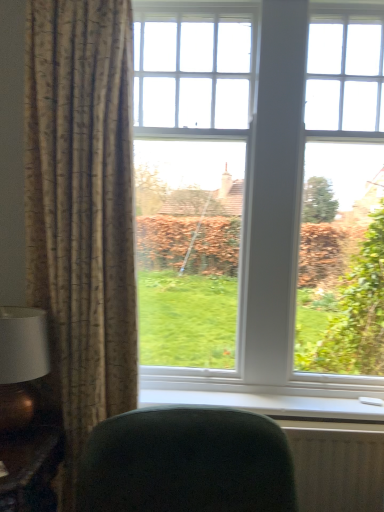
Locate an element on the screen. This screenshot has width=384, height=512. free space above white plastic window sill at lower center (from a real-world perspective) is located at coordinates (275, 398).